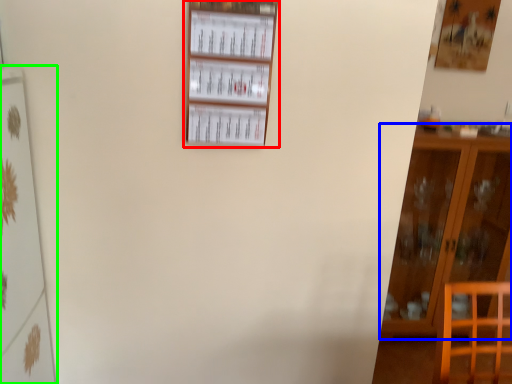
Question: Which object is the closest to the shelf (highlighted by a red box)? Choose among these: furniture (highlighted by a blue box) or shelf (highlighted by a green box).

Choices:
 (A) furniture
 (B) shelf

Answer: (B)